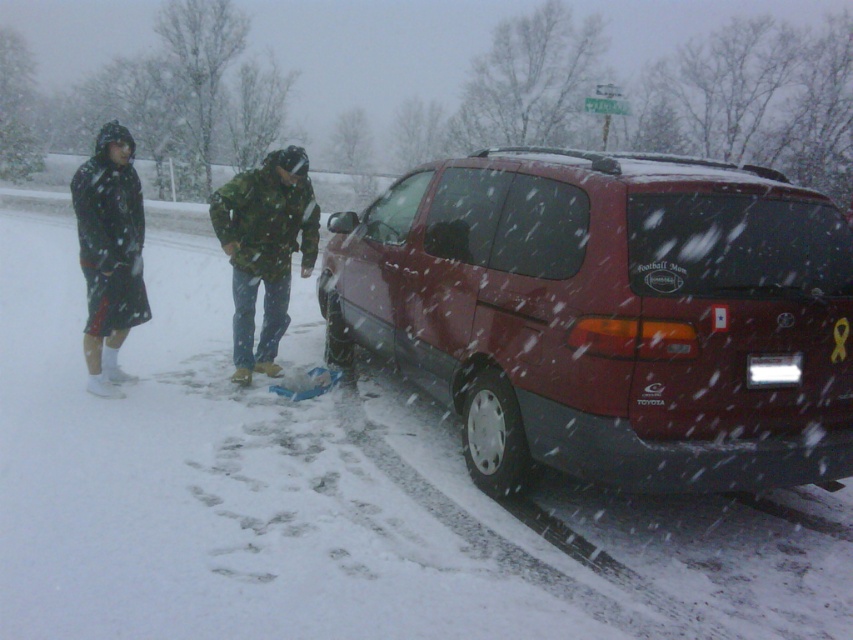
You are a delivery driver trying to pass by the matte red minivan at center and the matte black jacket at left. Which object is wider so you can plan your route accordingly?

The matte red minivan at center is wider than the matte black jacket at left, so you should plan your route around the wider vehicle to ensure enough space.

You are a delivery driver who needs to quickly determine which jacket is wider to decide which one to grab for warmth. You see the camouflage fabric jacket at center and the matte black jacket at left. Which one has a greater width?

The camouflage fabric jacket at center has a greater width than the matte black jacket at left.

Where is the camouflage fabric jacket at center located in the image?

The camouflage fabric jacket at center is located at the point with coordinates 0.391 in the x axis and 0.311 in the y axis.